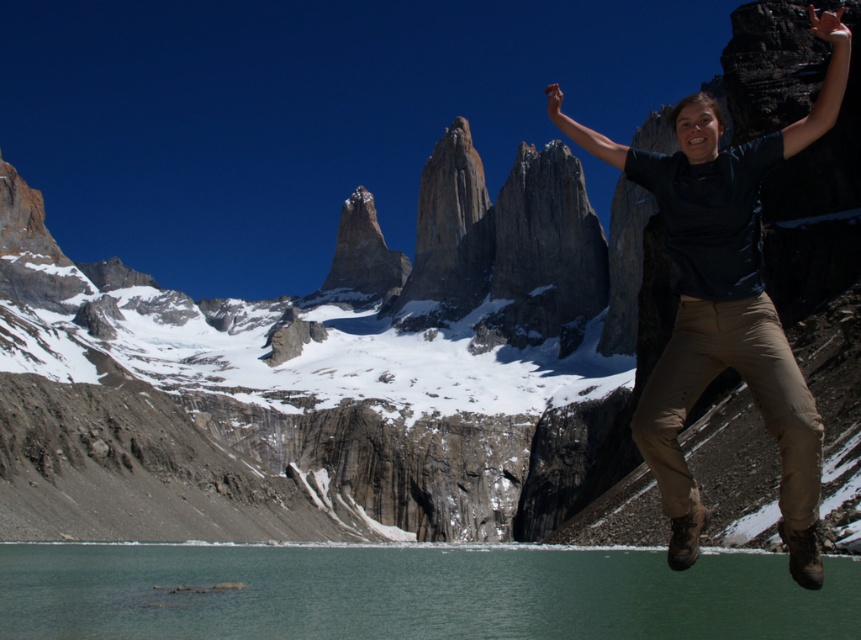
Does point (829, 586) lie in front of point (661, 388)?

That is False.

Does green water at lower center lie behind dark blue t-shirt at center?

Yes.

The width and height of the screenshot is (861, 640). What are the coordinates of `green water at lower center` in the screenshot? It's located at (412, 593).

This screenshot has height=640, width=861. Identify the location of green water at lower center. (412, 593).